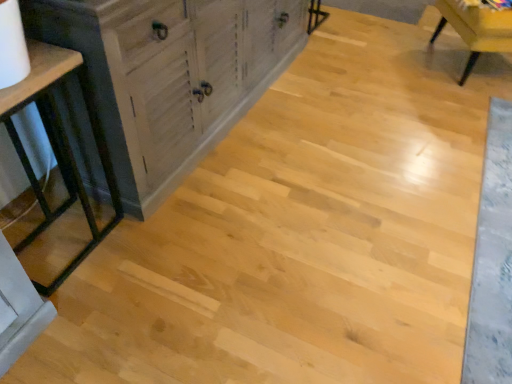
Find the location of `vacant region in front of matte black table at left`. vacant region in front of matte black table at left is located at coordinates (74, 329).